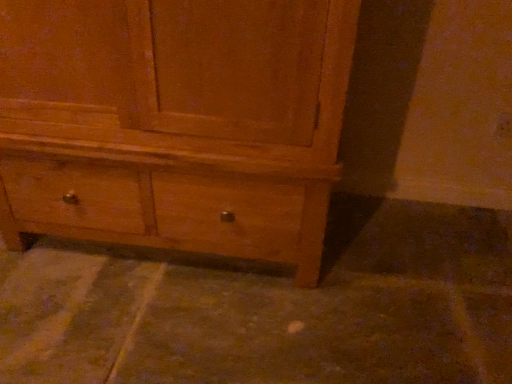
Question: Are brown concrete at lower center and matte wood chest of drawers at center located far from each other?

Choices:
 (A) yes
 (B) no

Answer: (B)

Question: Can you confirm if brown concrete at lower center is bigger than matte wood chest of drawers at center?

Choices:
 (A) no
 (B) yes

Answer: (A)

Question: Can you confirm if brown concrete at lower center is wider than matte wood chest of drawers at center?

Choices:
 (A) no
 (B) yes

Answer: (B)

Question: Is brown concrete at lower center in contact with matte wood chest of drawers at center?

Choices:
 (A) yes
 (B) no

Answer: (B)

Question: Is matte wood chest of drawers at center at the back of brown concrete at lower center?

Choices:
 (A) yes
 (B) no

Answer: (B)

Question: Can you confirm if brown concrete at lower center is positioned to the left of matte wood chest of drawers at center?

Choices:
 (A) yes
 (B) no

Answer: (B)

Question: Is there a large distance between matte wood chest of drawers at center and brown concrete at lower center?

Choices:
 (A) yes
 (B) no

Answer: (B)

Question: Considering the relative sizes of matte wood chest of drawers at center and brown concrete at lower center in the image provided, is matte wood chest of drawers at center thinner than brown concrete at lower center?

Choices:
 (A) no
 (B) yes

Answer: (B)

Question: Does matte wood chest of drawers at center have a greater height compared to brown concrete at lower center?

Choices:
 (A) no
 (B) yes

Answer: (B)

Question: Is brown concrete at lower center located within matte wood chest of drawers at center?

Choices:
 (A) no
 (B) yes

Answer: (A)

Question: Is matte wood chest of drawers at center facing away from brown concrete at lower center?

Choices:
 (A) no
 (B) yes

Answer: (A)

Question: Considering the relative sizes of matte wood chest of drawers at center and brown concrete at lower center in the image provided, is matte wood chest of drawers at center smaller than brown concrete at lower center?

Choices:
 (A) no
 (B) yes

Answer: (A)

Question: Based on their sizes in the image, would you say brown concrete at lower center is bigger or smaller than matte wood chest of drawers at center?

Choices:
 (A) big
 (B) small

Answer: (B)